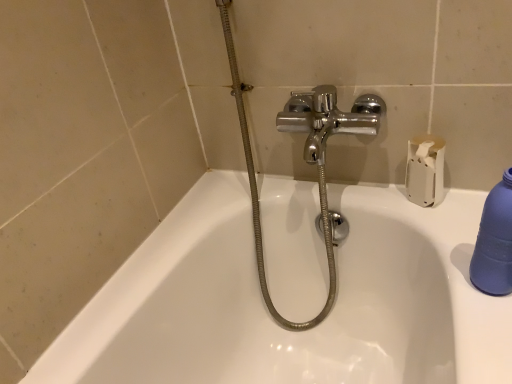
You are a GUI agent. You are given a task and a screenshot of the screen. Output one action in this format:
    pyautogui.click(x=<x>, y=<y>)
    Task: Click on the white matte toilet paper at upper right
    The image size is (512, 384).
    Given the screenshot: What is the action you would take?
    pyautogui.click(x=425, y=170)

Considering the relative sizes of blue matte bottle at right and chrome metallic shower at center in the image provided, is blue matte bottle at right taller than chrome metallic shower at center?

In fact, blue matte bottle at right may be shorter than chrome metallic shower at center.

Image resolution: width=512 pixels, height=384 pixels. Find the location of `cleaning product positioned vertically above the chrome metallic shower at center (from a real-world perspective)`. cleaning product positioned vertically above the chrome metallic shower at center (from a real-world perspective) is located at coordinates (495, 242).

In the image, is blue matte bottle at right positioned in front of or behind chrome metallic shower at center?

blue matte bottle at right is in front of chrome metallic shower at center.

Between chrome metallic shower at center and blue matte bottle at right, which one has more height?

Standing taller between the two is chrome metallic shower at center.

Choose the correct answer: Is chrome metallic shower at center inside blue matte bottle at right or outside it?

chrome metallic shower at center exists outside the volume of blue matte bottle at right.

From a real-world perspective, is chrome metallic shower at center positioned over blue matte bottle at right based on gravity?

No, from a real-world perspective, chrome metallic shower at center is not on top of blue matte bottle at right.

Find the location of a particular element. The image size is (512, 384). shower on the left of the blue matte bottle at right is located at coordinates (x=258, y=197).

Considering the relative positions of blue matte bottle at right and white matte toilet paper at upper right in the image provided, is blue matte bottle at right to the left or to the right of white matte toilet paper at upper right?

From the image, it's evident that blue matte bottle at right is to the right of white matte toilet paper at upper right.

Looking at the image, does blue matte bottle at right seem bigger or smaller compared to white matte toilet paper at upper right?

Considering their sizes, blue matte bottle at right takes up less space than white matte toilet paper at upper right.

Is blue matte bottle at right oriented towards white matte toilet paper at upper right?

No, blue matte bottle at right is not oriented towards white matte toilet paper at upper right.

Is blue matte bottle at right at the back of white matte toilet paper at upper right?

No, white matte toilet paper at upper right's orientation is not away from blue matte bottle at right.

Does white matte toilet paper at upper right have a greater width compared to blue matte bottle at right?

Yes.

From the image's perspective, relative to blue matte bottle at right, is white matte toilet paper at upper right above or below?

Based on their image positions, white matte toilet paper at upper right is located above blue matte bottle at right.

Which of these two, white matte toilet paper at upper right or chrome metallic shower at center, is smaller?

white matte toilet paper at upper right is smaller.

Locate an element on the screen. The image size is (512, 384). shower below the white matte toilet paper at upper right (from the image's perspective) is located at coordinates coord(258,197).

Is chrome metallic shower at center completely or partially inside white matte toilet paper at upper right?

That's incorrect, chrome metallic shower at center is not inside white matte toilet paper at upper right.

Is white matte toilet paper at upper right oriented towards chrome metallic shower at center?

No, white matte toilet paper at upper right is not facing towards chrome metallic shower at center.

Is chrome metallic shower at center positioned far away from white matte toilet paper at upper right?

No, chrome metallic shower at center is in close proximity to white matte toilet paper at upper right.

From a real-world perspective, who is located higher, chrome metallic shower at center or white matte toilet paper at upper right?

From a 3D spatial view, white matte toilet paper at upper right is above.

Is the depth of chrome metallic shower at center greater than that of white matte toilet paper at upper right?

No, it is in front of white matte toilet paper at upper right.

Identify the location of shower behind the blue matte bottle at right. The height and width of the screenshot is (384, 512). (258, 197).

I want to click on shower that is above the blue matte bottle at right (from the image's perspective), so click(x=258, y=197).

When comparing their distances from blue matte bottle at right, does white matte toilet paper at upper right or chrome metallic shower at center seem closer?

Based on the image, white matte toilet paper at upper right appears to be nearer to blue matte bottle at right.

Looking at the image, which one is located further to white matte toilet paper at upper right, blue matte bottle at right or chrome metallic shower at center?

The object further to white matte toilet paper at upper right is chrome metallic shower at center.

From the image, which object appears to be nearer to chrome metallic shower at center, blue matte bottle at right or white matte toilet paper at upper right?

white matte toilet paper at upper right is positioned closer to the anchor chrome metallic shower at center.

Looking at the image, which one is located further to blue matte bottle at right, chrome metallic shower at center or white matte toilet paper at upper right?

chrome metallic shower at center is positioned further to the anchor blue matte bottle at right.

When comparing their distances from white matte toilet paper at upper right, does chrome metallic shower at center or blue matte bottle at right seem closer?

Based on the image, blue matte bottle at right appears to be nearer to white matte toilet paper at upper right.

Considering their positions, is white matte toilet paper at upper right positioned further to chrome metallic shower at center than blue matte bottle at right?

Among the two, blue matte bottle at right is located further to chrome metallic shower at center.

Find the location of a particular element. This screenshot has height=384, width=512. toilet paper situated between chrome metallic shower at center and blue matte bottle at right from left to right is located at coordinates (425, 170).